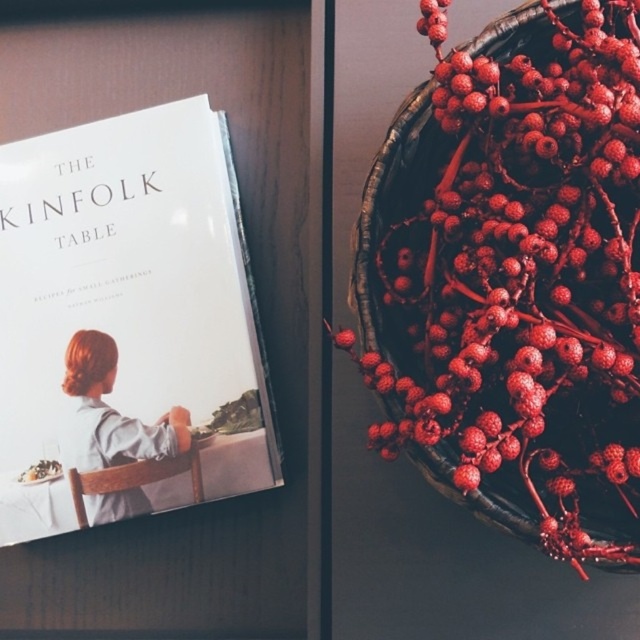
You are organizing a bookshelf and have a space that can only accommodate items up to the height of the matte gray dress at center. Can the white matte book at upper left fit in this space?

The white matte book at upper left is taller than the matte gray dress at center, so it cannot fit in the space designated for items up to the height of the matte gray dress at center.